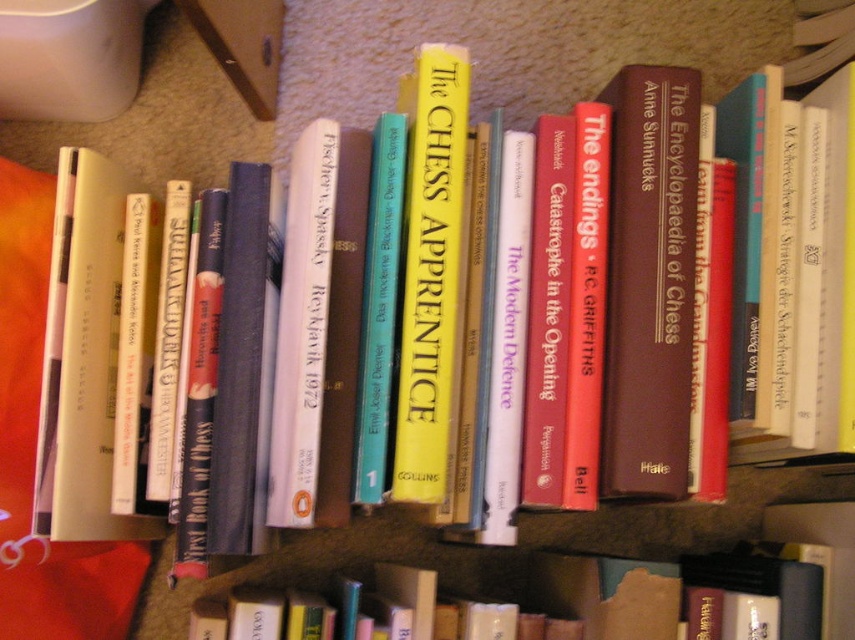
You are standing in front of a bookshelf and want to reach a point marked at coordinates (x=673, y=394). Your arm can extend 24 inches. Can you reach that point without moving closer?

The point at (x=673, y=394) is 26.51 inches away from you, which is beyond your arm extension of 24 inches. Therefore, you cannot reach it without moving closer.

You are trying to reach the hardcover book at center on the shelf but there is a white fabric pillow at left in the way. Can you move the pillow to access the book?

The hardcover book at center is behind the white fabric pillow at left, so you can move the pillow to access the book.